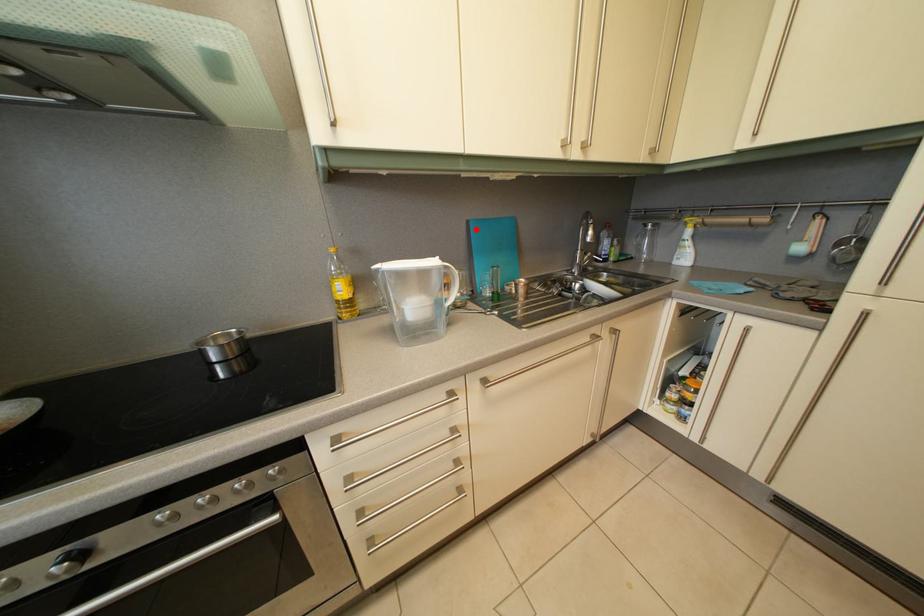
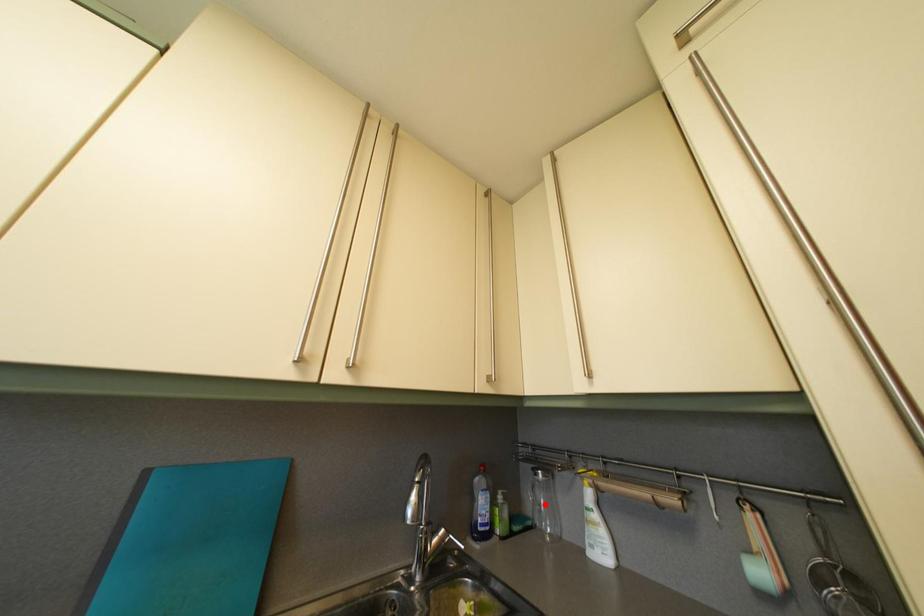
I am providing you with two images of the same scene from different viewpoints. A red point is marked on the first image and another point is marked on the second image. Does the point marked in image1 correspond to the same location as the one in image2?

No